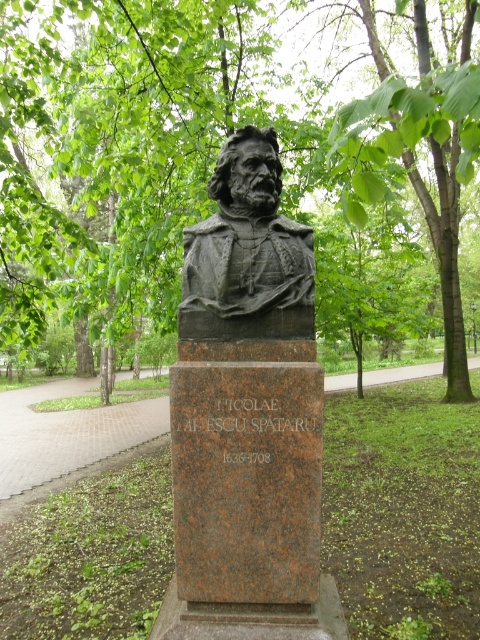
You are a park visitor standing in front of the brown granite bust at center. You want to take a photo of the bust without any obstructions. Is the green leafy tree at upper center blocking your view of the bust?

The green leafy tree at upper center has a smaller size compared to brown granite bust at center, so it might not block the view. However, since the tree is at upper center, its branches or leaves could still obstruct the top part of the bust depending on their spread. To ensure an unobstructed photo, you might need to adjust your angle or position.

You are a park visitor standing in front of the brown granite bust at center. Looking up, you notice the green leafy tree at upper center. Can you determine if the tree is above or below the bust?

The green leafy tree at upper center is positioned over the brown granite bust at center, so it is above the bust.

You are a park maintenance worker who needs to replace the pedestal of the brown granite bust at center and the dark gray stone bust at center. Which bust requires a larger pedestal?

The brown granite bust at center requires a larger pedestal because it is bigger than the dark gray stone bust at center.